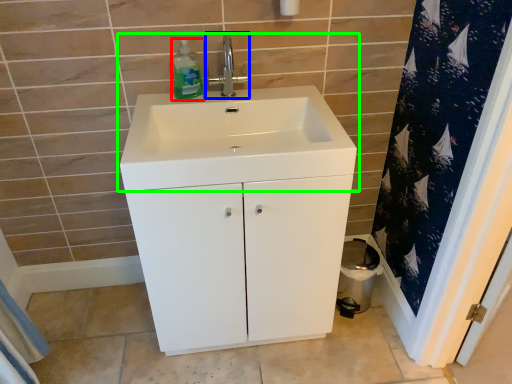
Question: Which object is positioned farthest from cleaning product (highlighted by a red box)? Select from tap (highlighted by a blue box) and sink (highlighted by a green box).

Choices:
 (A) tap
 (B) sink

Answer: (B)